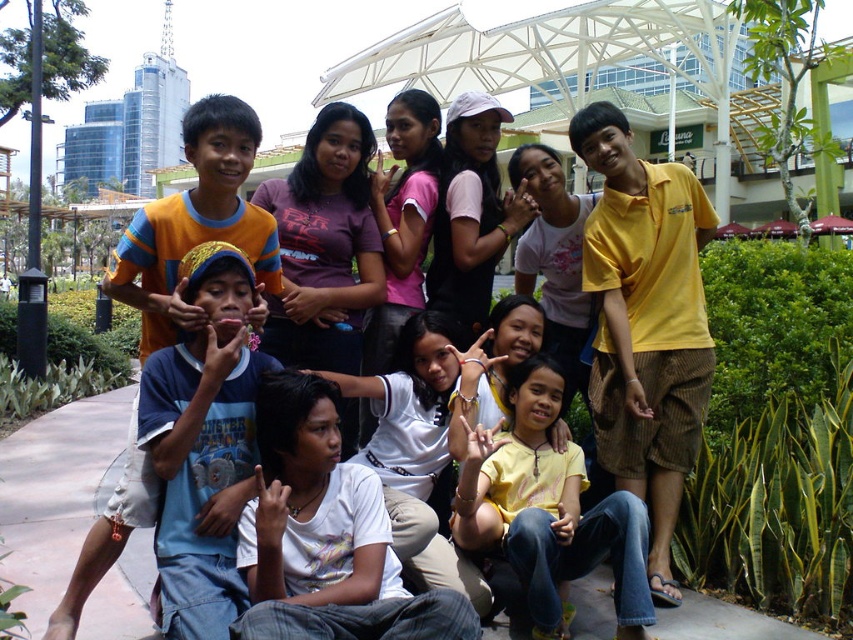
Question: Considering the relative positions of yellow cotton polo shirt at center and yellow matte shirt at center in the image provided, where is yellow cotton polo shirt at center located with respect to yellow matte shirt at center?

Choices:
 (A) below
 (B) above

Answer: (B)

Question: Estimate the real-world distances between objects in this image. Which object is farther from the yellow cotton polo shirt at center?

Choices:
 (A) blue cotton shirt at center
 (B) yellow matte shirt at center

Answer: (A)

Question: Which point is farther to the camera?

Choices:
 (A) blue cotton shirt at center
 (B) yellow matte shirt at center

Answer: (B)

Question: Is blue cotton shirt at center to the left of yellow matte shirt at center from the viewer's perspective?

Choices:
 (A) no
 (B) yes

Answer: (B)

Question: Which object is positioned farthest from the yellow cotton polo shirt at center?

Choices:
 (A) blue cotton shirt at center
 (B) yellow matte shirt at center

Answer: (A)

Question: Can you confirm if yellow cotton polo shirt at center is positioned above yellow matte shirt at center?

Choices:
 (A) no
 (B) yes

Answer: (B)